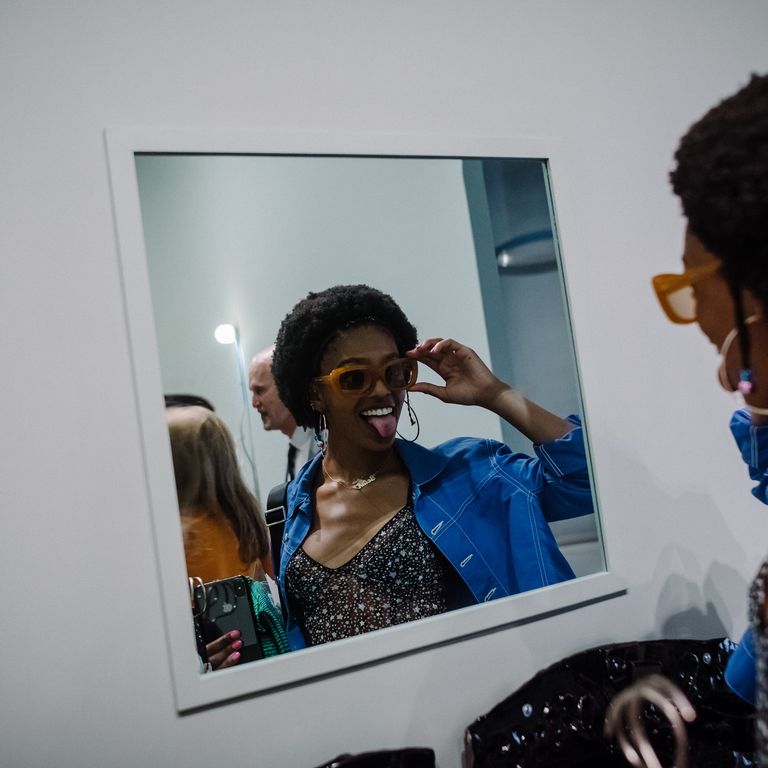
At what (x,y) coordinates should I click in order to perform the action: click on mirror. Please return your answer as a coordinate pair (x, y). Looking at the image, I should click on (263, 146).